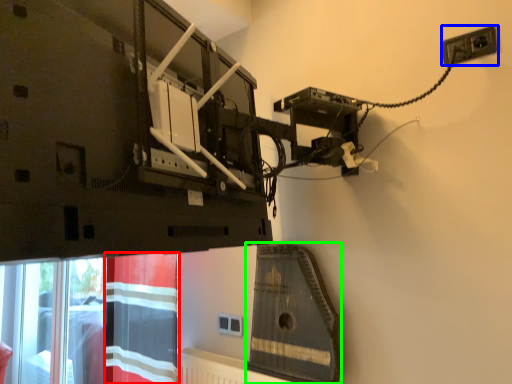
Question: Estimate the real-world distances between objects in this image. Which object is farther from curtain (highlighted by a red box), power plugs and sockets (highlighted by a blue box) or instrument (highlighted by a green box)?

Choices:
 (A) power plugs and sockets
 (B) instrument

Answer: (A)